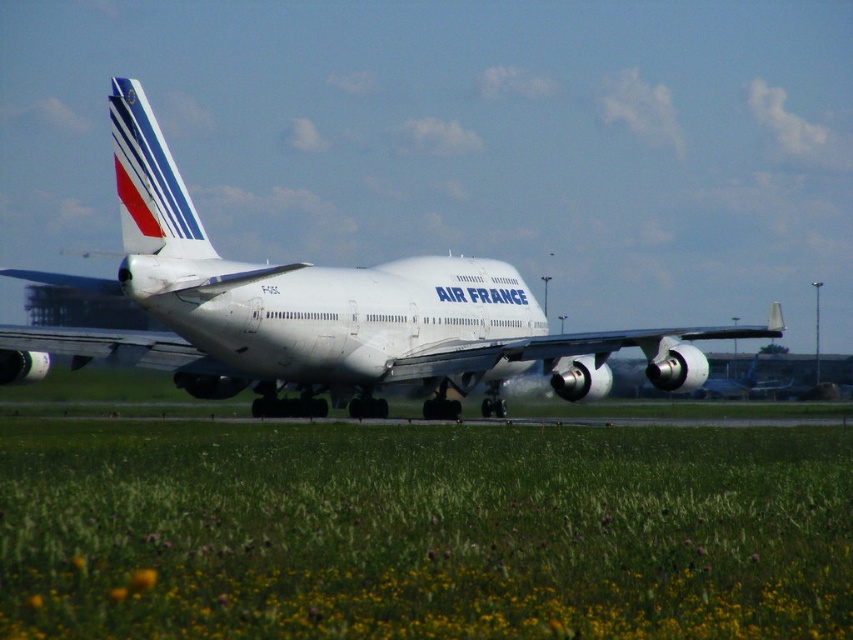
Question: Does green grass at center appear on the left side of white glossy airplane at center?

Choices:
 (A) no
 (B) yes

Answer: (B)

Question: Is the position of green grass at center less distant than that of white glossy airplane at center?

Choices:
 (A) yes
 (B) no

Answer: (A)

Question: Which point is closer to the camera?

Choices:
 (A) (270, 276)
 (B) (762, 529)

Answer: (B)

Question: Which of the following is the farthest from the observer?

Choices:
 (A) green grass at center
 (B) white glossy airplane at center

Answer: (B)

Question: Is green grass at center to the left of white glossy airplane at center from the viewer's perspective?

Choices:
 (A) yes
 (B) no

Answer: (A)

Question: Which point is farther to the camera?

Choices:
 (A) white glossy airplane at center
 (B) green grass at center

Answer: (A)